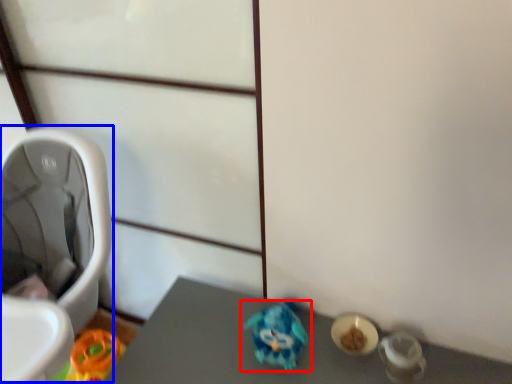
Question: Which object is closer to the camera taking this photo, toy (highlighted by a red box) or baby carriage (highlighted by a blue box)?

Choices:
 (A) toy
 (B) baby carriage

Answer: (B)